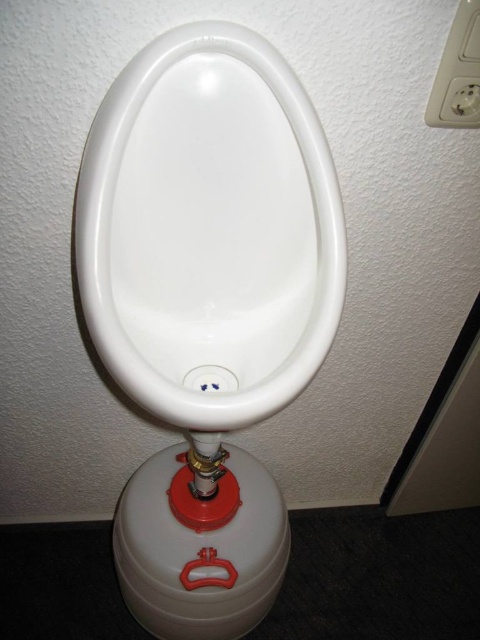
Is white glossy urinal at center positioned before white plastic outlet at upper right?

Yes, it is.

Find the location of a particular element. white glossy urinal at center is located at coordinates (208, 228).

Find the location of `white glossy urinal at center`. white glossy urinal at center is located at coordinates (x=208, y=228).